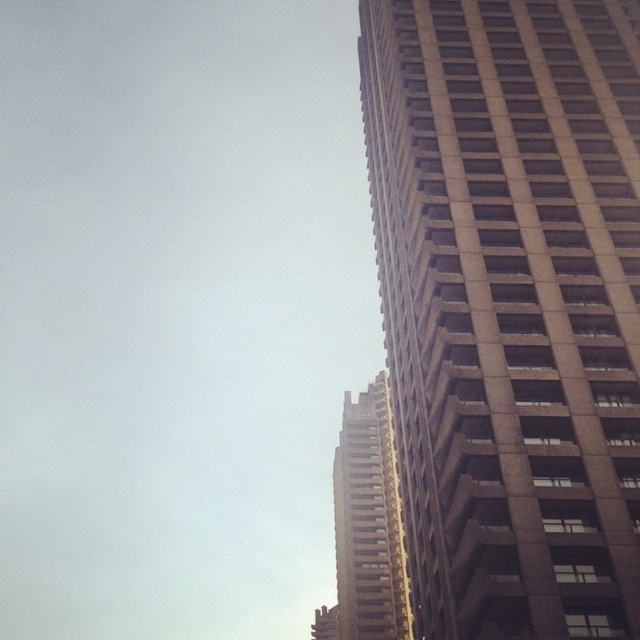
Question: Which point is closer to the camera?

Choices:
 (A) (452, 440)
 (B) (352, 465)

Answer: (A)

Question: Is brown concrete building at right positioned before brown concrete building at center?

Choices:
 (A) yes
 (B) no

Answer: (A)

Question: Can you confirm if brown concrete building at right is positioned above brown concrete building at center?

Choices:
 (A) no
 (B) yes

Answer: (B)

Question: Does brown concrete building at right appear under brown concrete building at center?

Choices:
 (A) no
 (B) yes

Answer: (A)